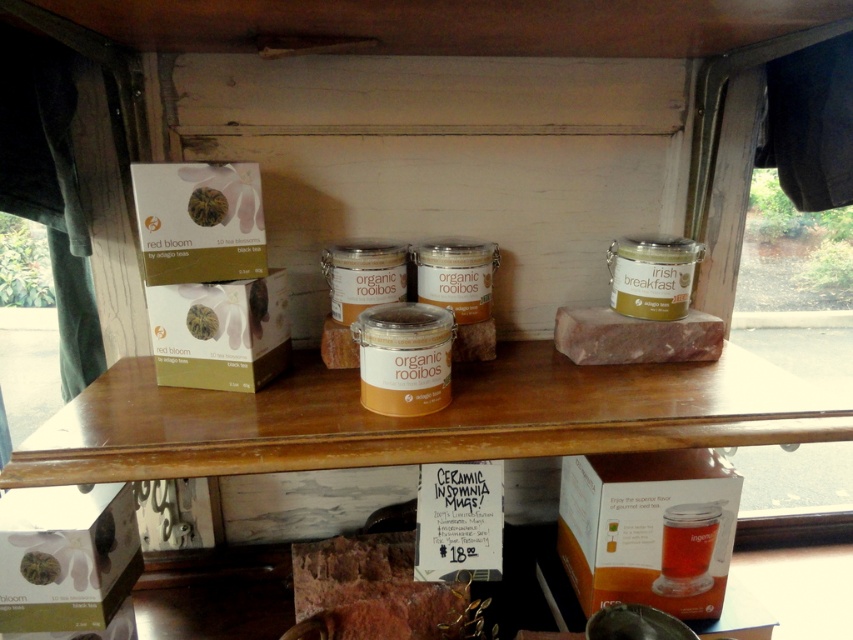
Can you confirm if matte green cardboard box at lower left is shorter than brown textured meat at center?

In fact, matte green cardboard box at lower left may be taller than brown textured meat at center.

Which is above, matte green cardboard box at lower left or brown textured meat at center?

matte green cardboard box at lower left is above.

Is point (94, 595) positioned in front of point (370, 634)?

That is True.

Locate an element on the screen. matte green cardboard box at lower left is located at coordinates [67, 556].

Can you confirm if clear plastic box at lower center is shorter than green matte box at center?

No.

Is the position of clear plastic box at lower center more distant than that of green matte box at center?

Yes.

Measure the distance between clear plastic box at lower center and camera.

37.31 inches

The width and height of the screenshot is (853, 640). Find the location of `clear plastic box at lower center`. clear plastic box at lower center is located at coordinates (648, 529).

Is wooden shelf at center smaller than matte green cardboard box at lower left?

No.

Is the position of wooden shelf at center less distant than that of matte green cardboard box at lower left?

That is True.

What do you see at coordinates (419, 419) in the screenshot?
I see `wooden shelf at center` at bounding box center [419, 419].

The width and height of the screenshot is (853, 640). What are the coordinates of `wooden shelf at center` in the screenshot? It's located at (419, 419).